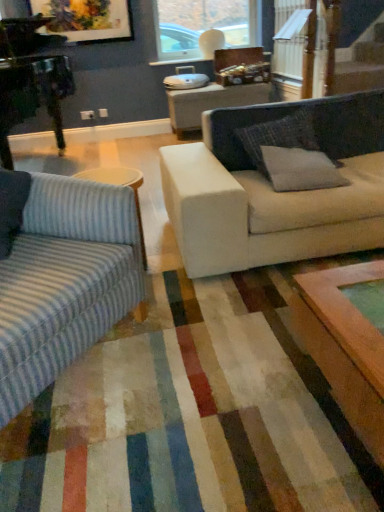
Question: Does transparent glass window at upper center have a lesser height compared to matte wooden picture frame at upper left?

Choices:
 (A) yes
 (B) no

Answer: (B)

Question: Can you confirm if transparent glass window at upper center is thinner than matte wooden picture frame at upper left?

Choices:
 (A) yes
 (B) no

Answer: (B)

Question: Is matte wooden picture frame at upper left surrounded by transparent glass window at upper center?

Choices:
 (A) yes
 (B) no

Answer: (B)

Question: From a real-world perspective, is transparent glass window at upper center over matte wooden picture frame at upper left?

Choices:
 (A) yes
 (B) no

Answer: (B)

Question: From a real-world perspective, is transparent glass window at upper center beneath matte wooden picture frame at upper left?

Choices:
 (A) yes
 (B) no

Answer: (A)

Question: Does transparent glass window at upper center have a greater height compared to matte wooden picture frame at upper left?

Choices:
 (A) no
 (B) yes

Answer: (B)

Question: Is striped fabric couch at left with gray fabric pillow at right, which ranks as the second pillow in back-to-front order?

Choices:
 (A) no
 (B) yes

Answer: (A)

Question: Is striped fabric couch at left not near gray fabric pillow at right, marked as the first pillow in a front-to-back arrangement?

Choices:
 (A) no
 (B) yes

Answer: (B)

Question: Considering the relative sizes of striped fabric couch at left and gray fabric pillow at right, which ranks as the second pillow in back-to-front order, in the image provided, is striped fabric couch at left thinner than gray fabric pillow at right, which ranks as the second pillow in back-to-front order,?

Choices:
 (A) yes
 (B) no

Answer: (B)

Question: Is striped fabric couch at left oriented towards gray fabric pillow at right, which ranks as the second pillow in back-to-front order?

Choices:
 (A) yes
 (B) no

Answer: (B)

Question: From a real-world perspective, is striped fabric couch at left on top of gray fabric pillow at right, which ranks as the second pillow in back-to-front order?

Choices:
 (A) no
 (B) yes

Answer: (A)

Question: Does striped fabric couch at left lie behind gray fabric pillow at right, which ranks as the second pillow in back-to-front order?

Choices:
 (A) yes
 (B) no

Answer: (B)

Question: Can you confirm if transparent glass window at upper center is wider than gray fabric pillow at right, marked as the first pillow in a front-to-back arrangement?

Choices:
 (A) no
 (B) yes

Answer: (A)